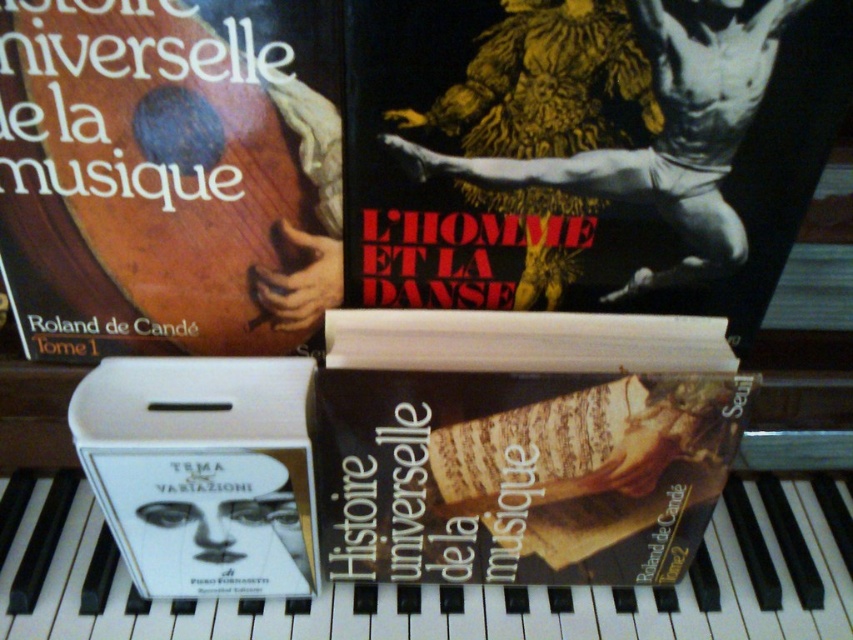
You are organizing a display on music history and need to place a new book between the brown paperback book at center and the white cardboard case at center. The new book is 3 inches thick. Will there be enough space between them to fit the new book?

The distance between the brown paperback book at center and the white cardboard case at center is 6.13 inches. Since the new book is 3 inches thick, there is sufficient space to fit it between them as 3 inches is less than 6.13 inches.

You are a robot positioned at the origin point of the piano keyboard. You need to reach the point at the far end of the keyboard. Which of the two points, point (x=276, y=157) or point (x=264, y=522), is closer to your destination?

Point (x=264, y=522) is closer to the far end of the piano keyboard since it is behind point (x=276, y=157).